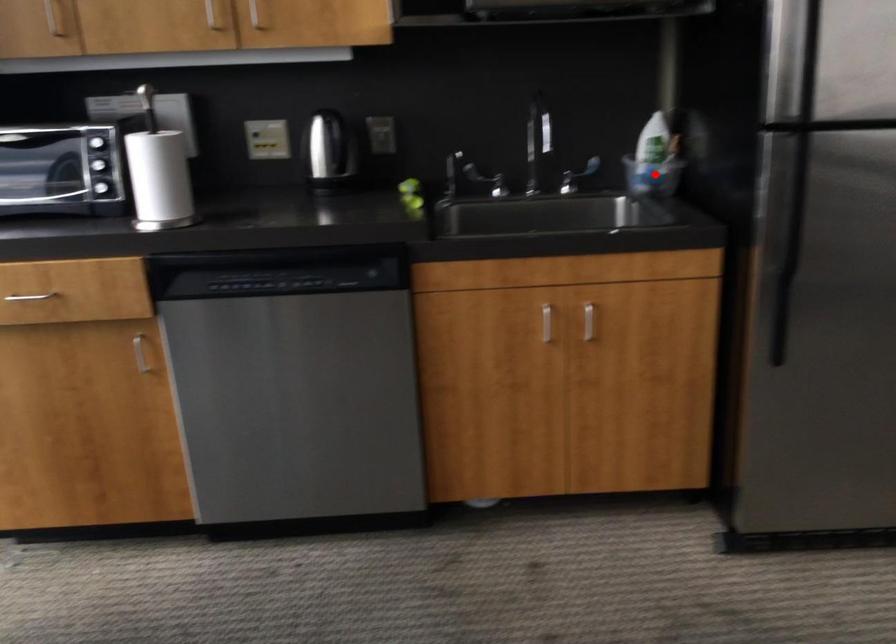
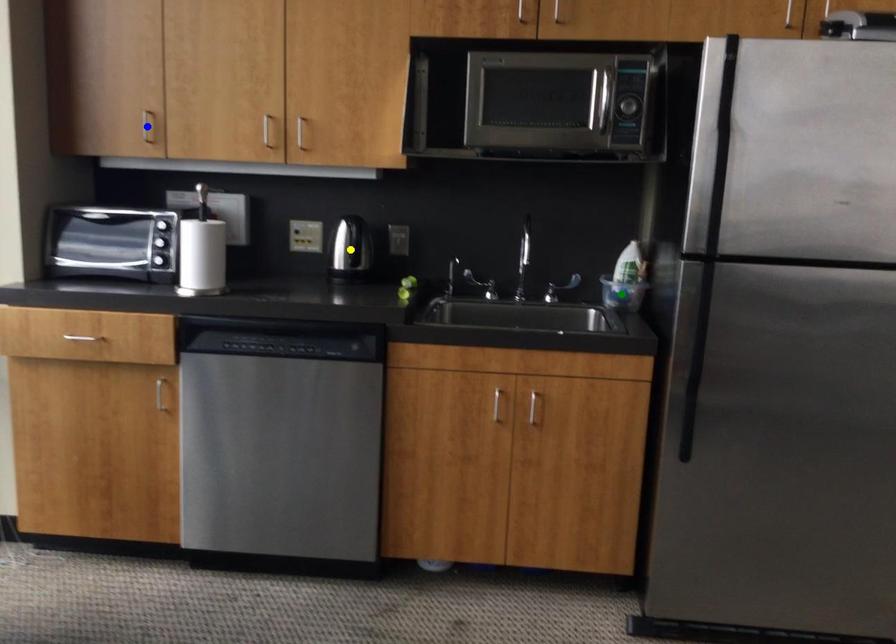
Question: I am providing you with two images of the same scene from different viewpoints. A red point is marked on the first image. You are given multiple points on the second image. Which spot in image 2 lines up with the point in image 1?

Choices:
 (A) blue point
 (B) green point
 (C) yellow point

Answer: (B)